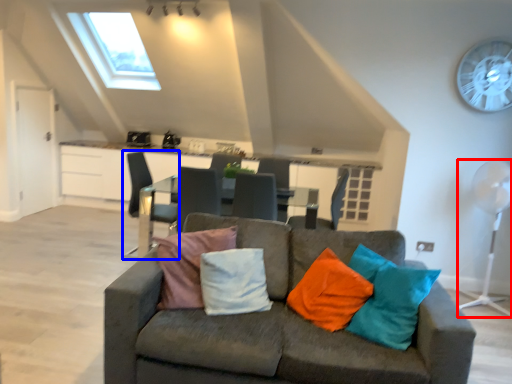
Question: Among these objects, which one is nearest to the camera, mechanical fan (highlighted by a red box) or chair (highlighted by a blue box)?

Choices:
 (A) mechanical fan
 (B) chair

Answer: (A)